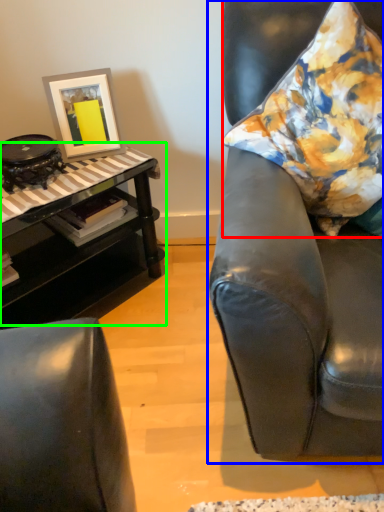
Question: Considering the real-world distances, which object is closest to pillow (highlighted by a red box)? chair (highlighted by a blue box) or table (highlighted by a green box).

Choices:
 (A) chair
 (B) table

Answer: (A)